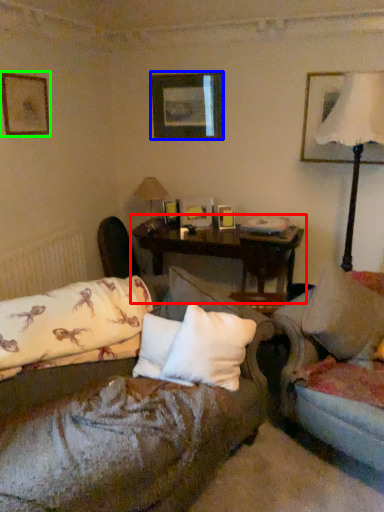
Question: Which object is positioned farthest from table (highlighted by a red box)? Select from picture frame (highlighted by a blue box) and picture frame (highlighted by a green box).

Choices:
 (A) picture frame
 (B) picture frame

Answer: (B)